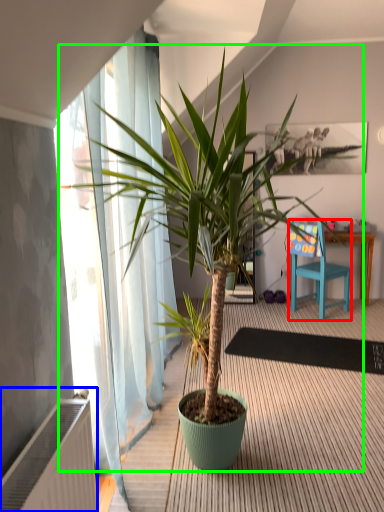
Question: Considering the real-world distances, which object is farthest from chair (highlighted by a red box)? radiator (highlighted by a blue box) or houseplant (highlighted by a green box)?

Choices:
 (A) radiator
 (B) houseplant

Answer: (A)